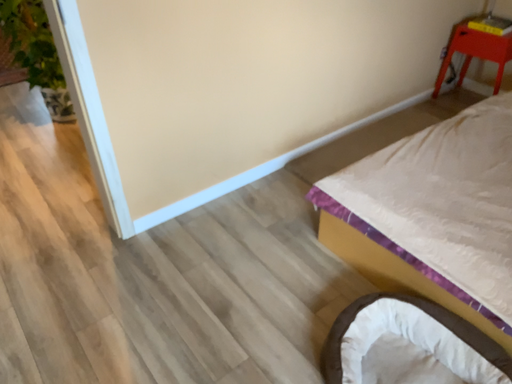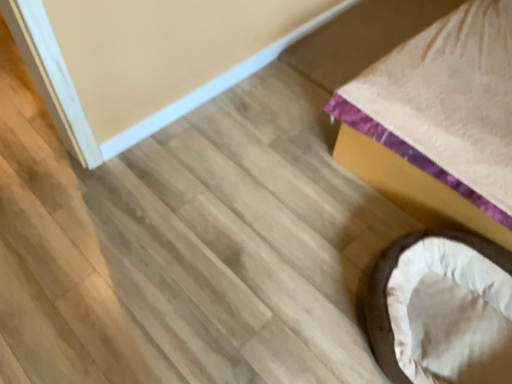
Question: Which way did the camera rotate in the video?

Choices:
 (A) rotated downward
 (B) rotated upward

Answer: (A)